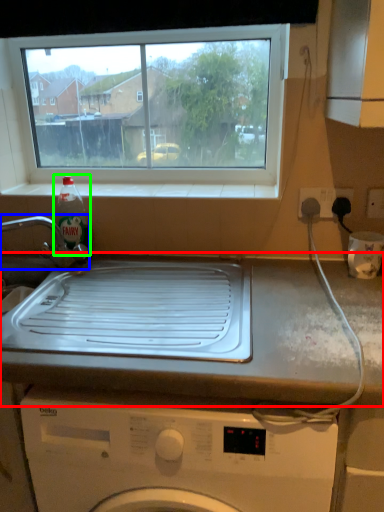
Question: Considering the real-world distances, which object is closest to countertop (highlighted by a red box)? tap (highlighted by a blue box) or bottle (highlighted by a green box).

Choices:
 (A) tap
 (B) bottle

Answer: (A)